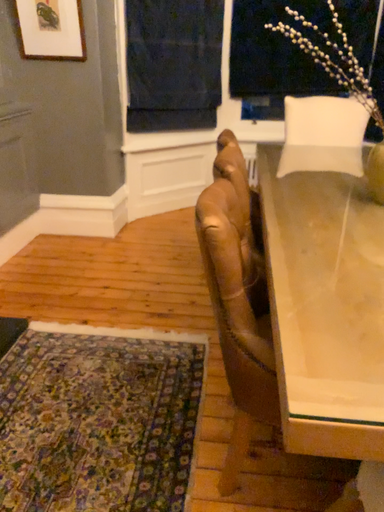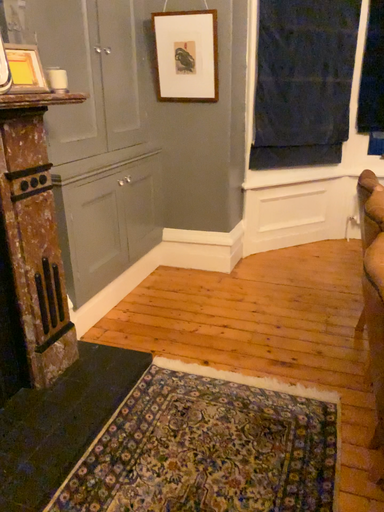
Question: How did the camera likely rotate when shooting the video?

Choices:
 (A) rotated left
 (B) rotated right

Answer: (A)